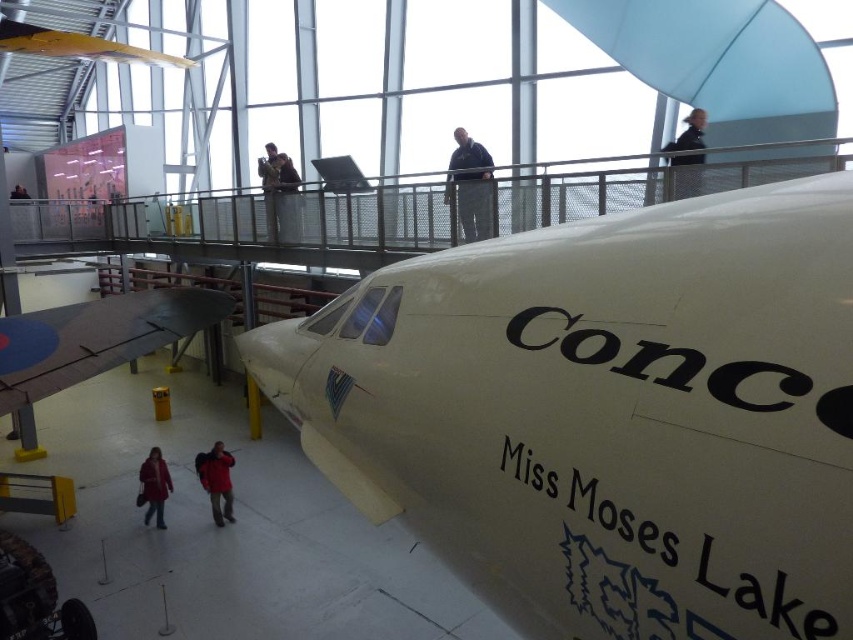
The width and height of the screenshot is (853, 640). What do you see at coordinates (686, 173) in the screenshot?
I see `black leather jacket at upper center` at bounding box center [686, 173].

Does black leather jacket at upper center have a greater width compared to dark blue jacket at upper center?

In fact, black leather jacket at upper center might be narrower than dark blue jacket at upper center.

Locate an element on the screen. black leather jacket at upper center is located at coordinates (686, 173).

Between dark blue fabric at upper center and dark blue jacket at upper center, which one has more height?

dark blue fabric at upper center

From the picture: Which is more to the left, dark blue fabric at upper center or dark blue jacket at upper center?

From the viewer's perspective, dark blue jacket at upper center appears more on the left side.

Who is more forward, (473,156) or (287,232)?

Positioned in front is point (473,156).

You are a GUI agent. You are given a task and a screenshot of the screen. Output one action in this format:
    pyautogui.click(x=<x>, y=<y>)
    Task: Click on the dark blue fabric at upper center
    The height and width of the screenshot is (640, 853).
    Given the screenshot: What is the action you would take?
    pyautogui.click(x=471, y=186)

Does red jacket at lower left appear on the right side of dark blue jacket at upper center?

No, red jacket at lower left is not to the right of dark blue jacket at upper center.

Does red jacket at lower left lie in front of dark blue jacket at upper center?

Yes.

This screenshot has width=853, height=640. What are the coordinates of `red jacket at lower left` in the screenshot? It's located at (216, 481).